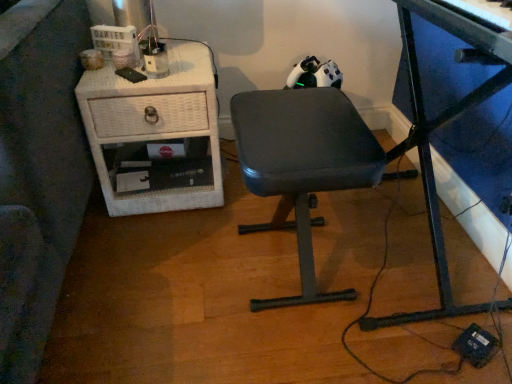
In order to click on free area in between white wicker nightstand at left and dark gray fabric chair at center in this screenshot , I will do `click(198, 235)`.